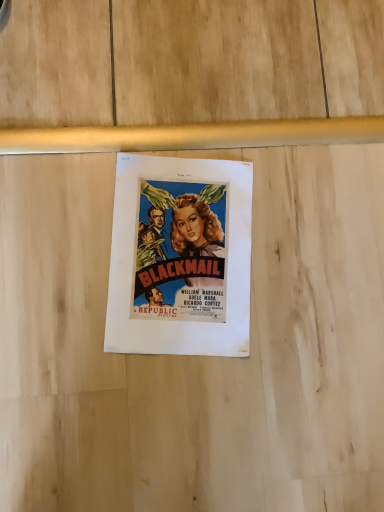
Locate an element on the screen. Image resolution: width=384 pixels, height=512 pixels. empty space that is ontop of matte paper poster at center is located at coordinates (186, 249).